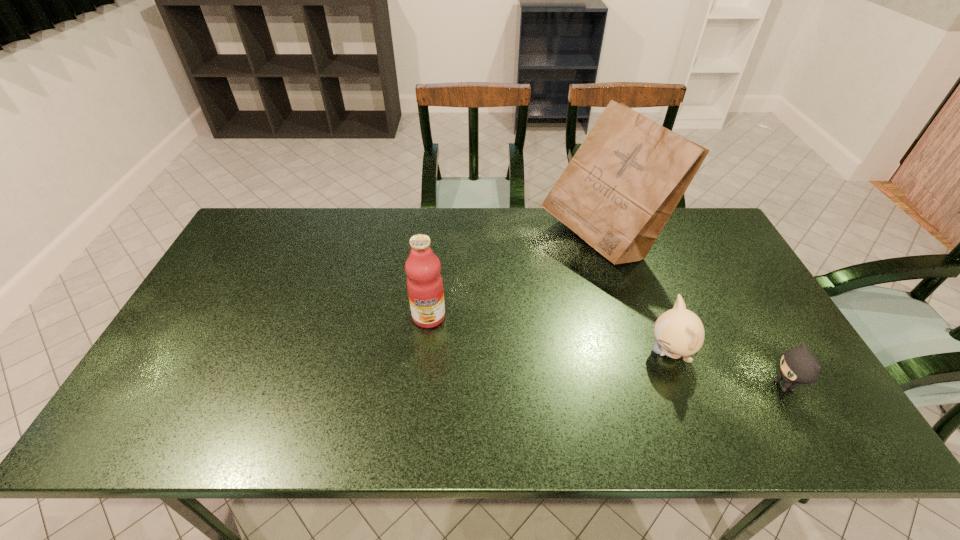
Image resolution: width=960 pixels, height=540 pixels. I want to click on vacant space at the far edge of the desktop, so click(x=482, y=239).

At what (x,y) coordinates should I click in order to perform the action: click on vacant space at the near edge. Please return your answer as a coordinate pair (x, y). Looking at the image, I should click on (634, 421).

This screenshot has width=960, height=540. Identify the location of vacant space at the left edge. click(236, 305).

The width and height of the screenshot is (960, 540). In the image, there is a desktop. Find the location of `vacant space at the right edge`. vacant space at the right edge is located at coordinates (688, 270).

This screenshot has width=960, height=540. I want to click on blank area at the far left corner, so click(x=242, y=242).

The height and width of the screenshot is (540, 960). I want to click on vacant space at the far right corner of the desktop, so click(684, 226).

The height and width of the screenshot is (540, 960). I want to click on empty space between the leftmost object and the rightmost object, so click(x=607, y=351).

You are a GUI agent. You are given a task and a screenshot of the screen. Output one action in this format:
    pyautogui.click(x=<x>, y=<y>)
    Task: Click on the free space between the shortest object and the fruit juice
    
    Given the screenshot: What is the action you would take?
    pyautogui.click(x=607, y=351)

Where is `free area in between the leftmost object and the taller kitten`? The image size is (960, 540). free area in between the leftmost object and the taller kitten is located at coordinates (549, 334).

Locate an element on the screen. This screenshot has height=540, width=960. free space between the third nearest object and the second shortest object is located at coordinates (549, 334).